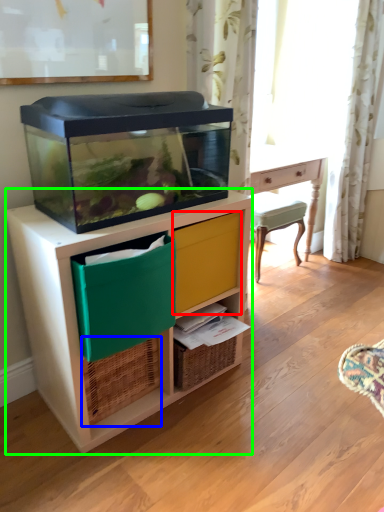
Question: Which is nearer to the drawer (highlighted by a red box)? basket (highlighted by a blue box) or chest of drawers (highlighted by a green box).

Choices:
 (A) basket
 (B) chest of drawers

Answer: (B)